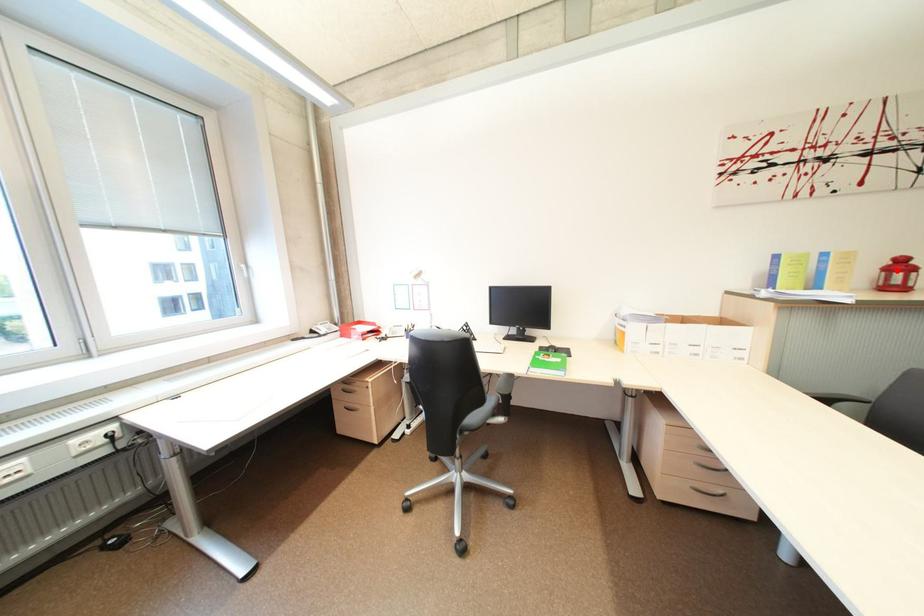
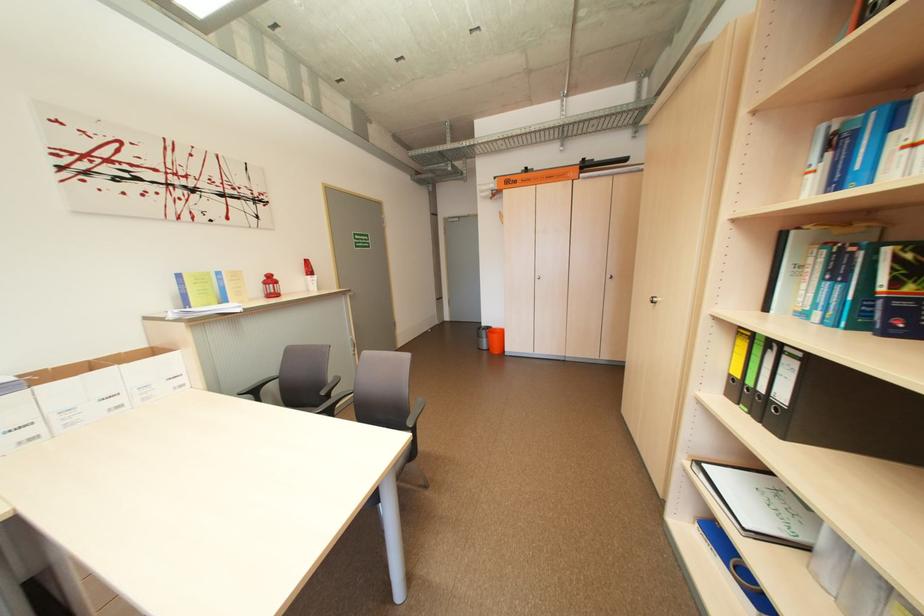
Question: I am providing you with two images of the same scene from different viewpoints. Given a red point in image1, look at the same physical point in image2. Is it:

Choices:
 (A) Closer to the viewpoint
 (B) Farther from the viewpoint

Answer: (A)